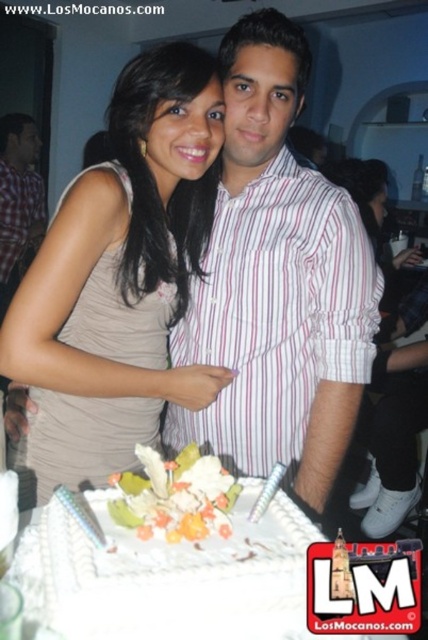
Question: Based on their relative distances, which object is nearer to the pink striped shirt at center?

Choices:
 (A) matte beige dress at center
 (B) white frosted cake at center

Answer: (A)

Question: From the image, what is the correct spatial relationship of pink striped shirt at center in relation to white frosted cake at center?

Choices:
 (A) below
 (B) above

Answer: (B)

Question: Among these points, which one is farthest from the camera?

Choices:
 (A) (284, 493)
 (B) (91, 472)

Answer: (B)

Question: Which object appears farthest from the camera in this image?

Choices:
 (A) pink striped shirt at center
 (B) checkered fabric shirt at left
 (C) white frosted cake at center
 (D) matte beige dress at center

Answer: (B)

Question: Does pink striped shirt at center have a larger size compared to white frosted cake at center?

Choices:
 (A) no
 (B) yes

Answer: (B)

Question: Considering the relative positions of matte beige dress at center and checkered fabric shirt at left in the image provided, where is matte beige dress at center located with respect to checkered fabric shirt at left?

Choices:
 (A) left
 (B) right

Answer: (B)